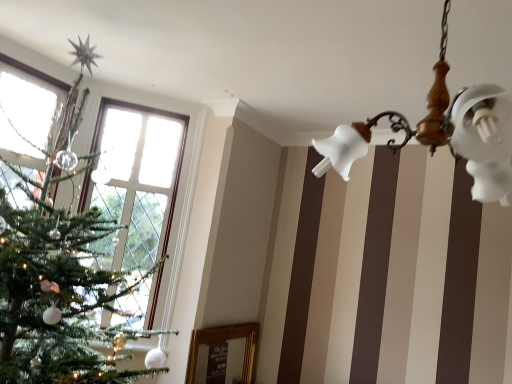
What is the approximate width of white glass chandelier at upper right?

The width of white glass chandelier at upper right is 22.02 inches.

Identify the location of white glass chandelier at upper right. The width and height of the screenshot is (512, 384). (442, 132).

The width and height of the screenshot is (512, 384). Describe the element at coordinates (442, 132) in the screenshot. I see `white glass chandelier at upper right` at that location.

This screenshot has height=384, width=512. What do you see at coordinates (136, 180) in the screenshot?
I see `clear glass window at left` at bounding box center [136, 180].

Measure the distance between clear glass window at left and camera.

They are 2.75 meters apart.

What are the coordinates of `clear glass window at left` in the screenshot? It's located at (136, 180).

You are a GUI agent. You are given a task and a screenshot of the screen. Output one action in this format:
    pyautogui.click(x=<x>, y=<y>)
    Task: Click on the white glass chandelier at upper right
    This screenshot has height=384, width=512.
    Given the screenshot: What is the action you would take?
    pyautogui.click(x=442, y=132)

Consider the image. Considering the relative positions of white glass chandelier at upper right and clear glass window at left in the image provided, is white glass chandelier at upper right to the left or to the right of clear glass window at left?

Clearly, white glass chandelier at upper right is on the right of clear glass window at left in the image.

Is white glass chandelier at upper right positioned in front of clear glass window at left?

Yes, white glass chandelier at upper right is closer to the camera.

Which is closer to the camera, (323, 140) or (160, 236)?

Point (323, 140).

From the image's perspective, would you say white glass chandelier at upper right is positioned over clear glass window at left?

Yes.

From a real-world perspective, is white glass chandelier at upper right above or below clear glass window at left?

In terms of real-world spatial position, white glass chandelier at upper right is above clear glass window at left.

Considering the sizes of white glass chandelier at upper right and clear glass window at left in the image, is white glass chandelier at upper right wider or thinner than clear glass window at left?

Clearly, white glass chandelier at upper right has more width compared to clear glass window at left.

Does white glass chandelier at upper right have a greater height compared to clear glass window at left?

No, white glass chandelier at upper right is not taller than clear glass window at left.

Is white glass chandelier at upper right bigger or smaller than clear glass window at left?

Clearly, white glass chandelier at upper right is larger in size than clear glass window at left.

Is white glass chandelier at upper right completely or partially outside of clear glass window at left?

Yes, white glass chandelier at upper right is located beyond the bounds of clear glass window at left.

From the picture: Is there a large distance between white glass chandelier at upper right and clear glass window at left?

Indeed, white glass chandelier at upper right is not near clear glass window at left.

Is white glass chandelier at upper right oriented towards clear glass window at left?

No, white glass chandelier at upper right is not aimed at clear glass window at left.

Can you tell me how much white glass chandelier at upper right and clear glass window at left differ in facing direction?

The angular difference between white glass chandelier at upper right and clear glass window at left is 41.5 degrees.

Locate an element on the screen. The height and width of the screenshot is (384, 512). window on the left of the white glass chandelier at upper right is located at coordinates (136, 180).

Visually, is clear glass window at left positioned to the left or to the right of white glass chandelier at upper right?

From the image, it's evident that clear glass window at left is to the left of white glass chandelier at upper right.

Based on the photo, between clear glass window at left and white glass chandelier at upper right, which one is positioned in front?

white glass chandelier at upper right is in front.

Between point (140, 119) and point (497, 150), which one is positioned in front?

The point (497, 150) is more forward.

In the scene shown: From the image's perspective, which is below, clear glass window at left or white glass chandelier at upper right?

clear glass window at left.

From a real-world perspective, is clear glass window at left under white glass chandelier at upper right?

Yes, from a real-world perspective, clear glass window at left is below white glass chandelier at upper right.

Looking at their sizes, would you say clear glass window at left is wider or thinner than white glass chandelier at upper right?

Considering their sizes, clear glass window at left looks slimmer than white glass chandelier at upper right.

Looking at this image, is clear glass window at left taller or shorter than white glass chandelier at upper right?

Clearly, clear glass window at left is taller compared to white glass chandelier at upper right.

Can you confirm if clear glass window at left is smaller than white glass chandelier at upper right?

Yes.

Is clear glass window at left spatially inside white glass chandelier at upper right, or outside of it?

clear glass window at left is not inside white glass chandelier at upper right, it's outside.

Are clear glass window at left and white glass chandelier at upper right making contact?

They are not placed beside each other.

Is clear glass window at left looking in the opposite direction of white glass chandelier at upper right?

No, clear glass window at left is not facing away from white glass chandelier at upper right.

The width and height of the screenshot is (512, 384). Identify the location of light fixture on the right side of clear glass window at left. (442, 132).

Find the location of `light fixture in front of the clear glass window at left`. light fixture in front of the clear glass window at left is located at coordinates (442, 132).

Identify the location of window behind the white glass chandelier at upper right. (136, 180).